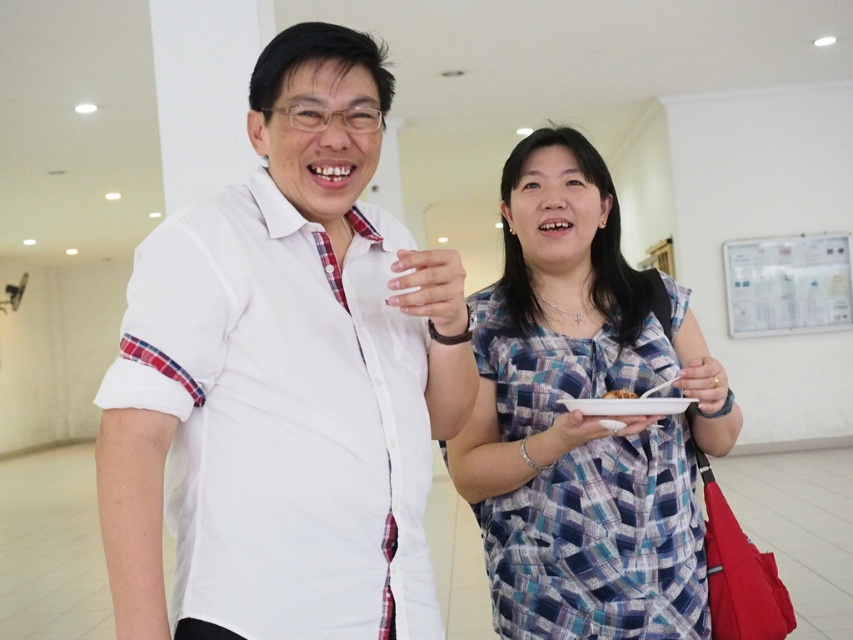
Question: Which point appears farthest from the camera in this image?

Choices:
 (A) (527, 440)
 (B) (399, 432)
 (C) (575, 426)
 (D) (618, 396)

Answer: (A)

Question: Which point is farther to the camera?

Choices:
 (A) smooth white plate at center
 (B) white matte plate at center
 (C) white cotton shirt at center
 (D) blue plaid dress at center

Answer: (A)

Question: Can you confirm if white cotton shirt at center is smaller than smooth white plate at center?

Choices:
 (A) no
 (B) yes

Answer: (A)

Question: Does white cotton shirt at center appear on the right side of white matte plate at center?

Choices:
 (A) yes
 (B) no

Answer: (B)

Question: Which object is positioned closest to the blue plaid dress at center?

Choices:
 (A) white cotton shirt at center
 (B) smooth white plate at center
 (C) white matte plate at center

Answer: (C)

Question: Considering the relative positions of white cotton shirt at center and white matte plate at center in the image provided, where is white cotton shirt at center located with respect to white matte plate at center?

Choices:
 (A) right
 (B) left

Answer: (B)